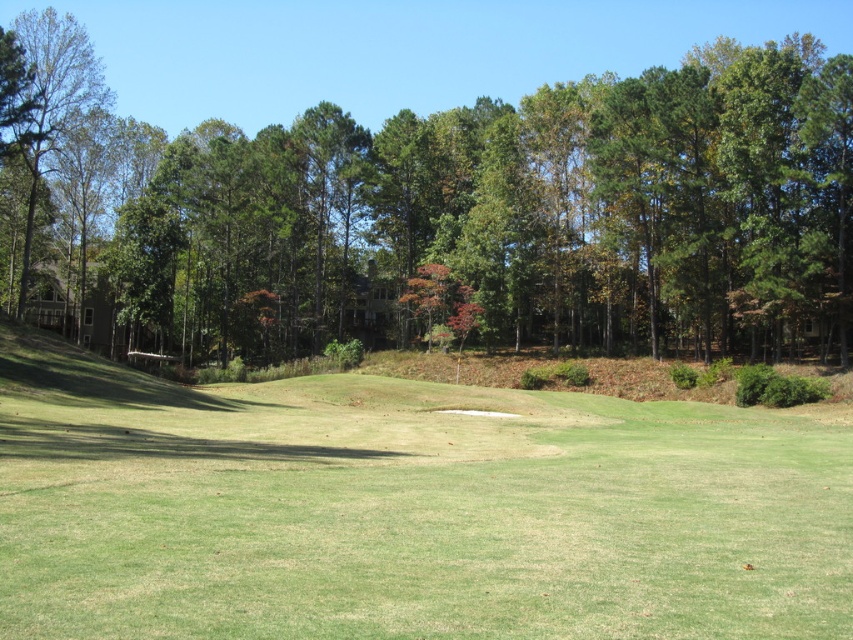
Question: Does green grassy field at center come in front of green leafy tree at center?

Choices:
 (A) no
 (B) yes

Answer: (B)

Question: Which point is farther from the camera taking this photo?

Choices:
 (A) (386, 458)
 (B) (821, 356)

Answer: (B)

Question: Does green grassy field at center appear over green leafy tree at center?

Choices:
 (A) yes
 (B) no

Answer: (B)

Question: Is the position of green grassy field at center less distant than that of green leafy tree at center?

Choices:
 (A) yes
 (B) no

Answer: (A)